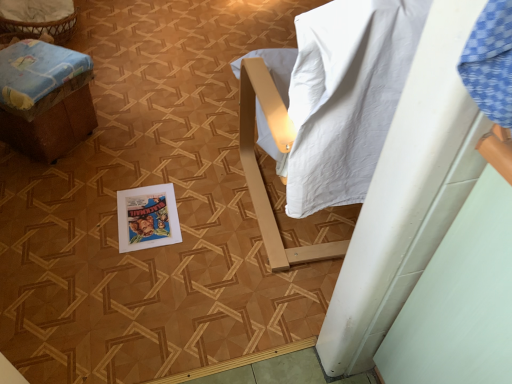
Where is `free space in front of brown cardboard box at left`? Image resolution: width=512 pixels, height=384 pixels. free space in front of brown cardboard box at left is located at coordinates (53, 208).